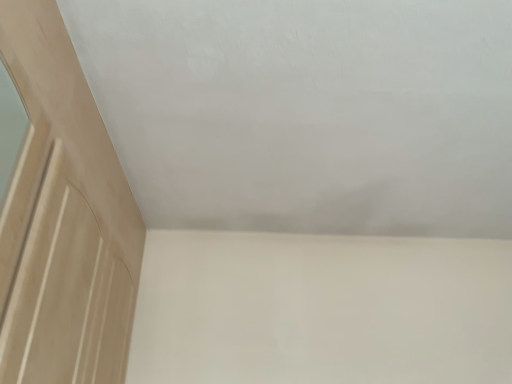
What is the approximate height of light wood door at left?

light wood door at left is 53.63 centimeters tall.

Image resolution: width=512 pixels, height=384 pixels. What do you see at coordinates (63, 218) in the screenshot?
I see `light wood door at left` at bounding box center [63, 218].

What are the coordinates of `light wood door at left` in the screenshot? It's located at (63, 218).

Based on the photo, what is the approximate width of light wood door at left?

light wood door at left is 1.91 inches wide.

At what (x,y) coordinates should I click in order to perform the action: click on light wood door at left. Please return your answer as a coordinate pair (x, y). Looking at the image, I should click on (63, 218).